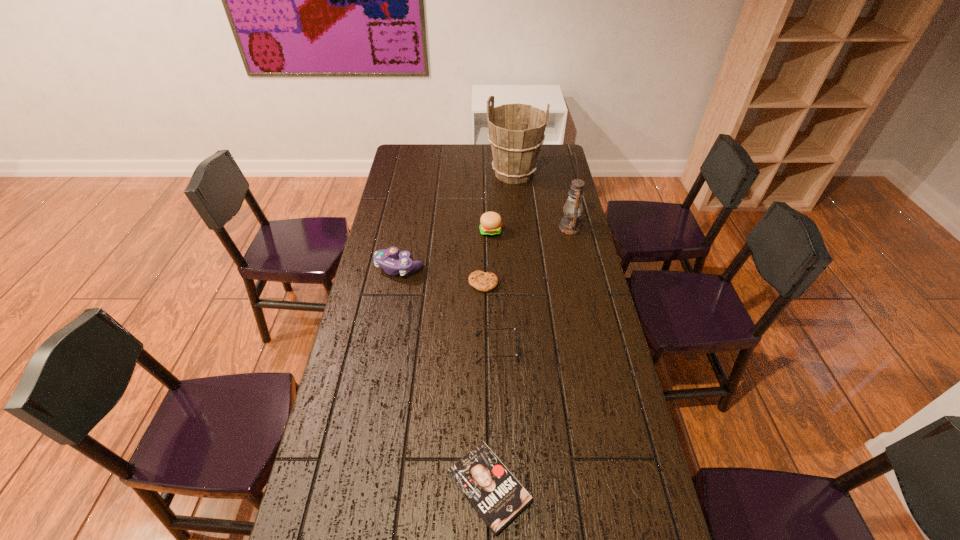
Locate an element on the screen. bucket is located at coordinates (516, 131).

Find the location of a particular element. The height and width of the screenshot is (540, 960). oil lamp is located at coordinates (570, 224).

Where is `hamburger`? hamburger is located at coordinates (491, 223).

Where is `the leftmost object`? Image resolution: width=960 pixels, height=540 pixels. the leftmost object is located at coordinates (385, 258).

At what (x,y) coordinates should I click in order to perform the action: click on spectacles. Please return your answer as a coordinate pair (x, y). Looking at the image, I should click on coord(515,329).

This screenshot has height=540, width=960. I want to click on the second nearest object, so click(x=515, y=329).

Where is `cookie`? This screenshot has height=540, width=960. cookie is located at coordinates (482, 281).

This screenshot has width=960, height=540. In order to click on book in this screenshot , I will do `click(496, 495)`.

Identify the location of vacant area situated on the front of the farthest object. This screenshot has height=540, width=960. (517, 206).

The height and width of the screenshot is (540, 960). I want to click on vacant point located on the front of the rightmost object, so click(580, 269).